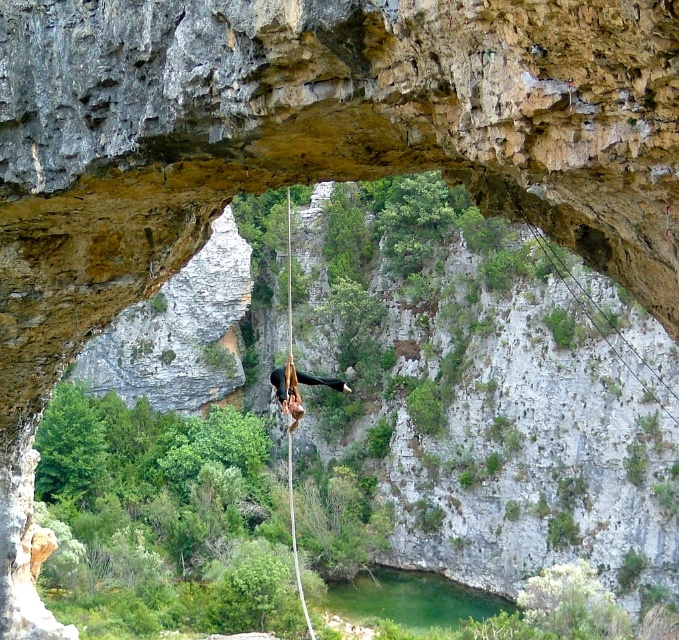
Question: Is rope at center positioned before black matte rock climber at center?

Choices:
 (A) yes
 (B) no

Answer: (B)

Question: Which point is farther from the camera taking this photo?

Choices:
 (A) (289, 346)
 (B) (293, 396)

Answer: (A)

Question: Can you confirm if rope at center is positioned to the right of black matte rock climber at center?

Choices:
 (A) no
 (B) yes

Answer: (A)

Question: Does rope at center appear over black matte rock climber at center?

Choices:
 (A) yes
 (B) no

Answer: (B)